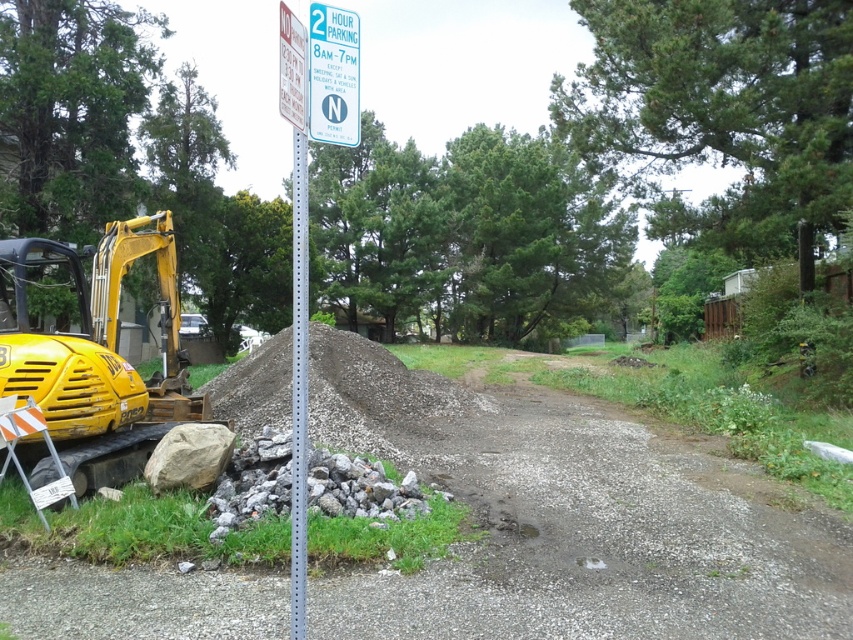
Question: Which of the following is the closest to the observer?

Choices:
 (A) blue plastic sign at upper center
 (B) metallic gray pole at upper center
 (C) yellow rubber excavator at lower left

Answer: (B)

Question: Can you confirm if yellow rubber excavator at lower left is smaller than blue plastic sign at upper center?

Choices:
 (A) yes
 (B) no

Answer: (B)

Question: Among these objects, which one is nearest to the camera?

Choices:
 (A) yellow rubber excavator at lower left
 (B) gray gravel dirt track at center
 (C) metallic gray pole at upper center
 (D) blue plastic sign at upper center

Answer: (C)

Question: Among these objects, which one is farthest from the camera?

Choices:
 (A) metallic gray pole at upper center
 (B) yellow rubber excavator at lower left
 (C) gray gravel dirt track at center

Answer: (B)

Question: Does gray gravel dirt track at center have a lesser width compared to metallic gray pole at upper center?

Choices:
 (A) no
 (B) yes

Answer: (A)

Question: Can you confirm if gray gravel dirt track at center is smaller than metallic gray pole at upper center?

Choices:
 (A) no
 (B) yes

Answer: (B)